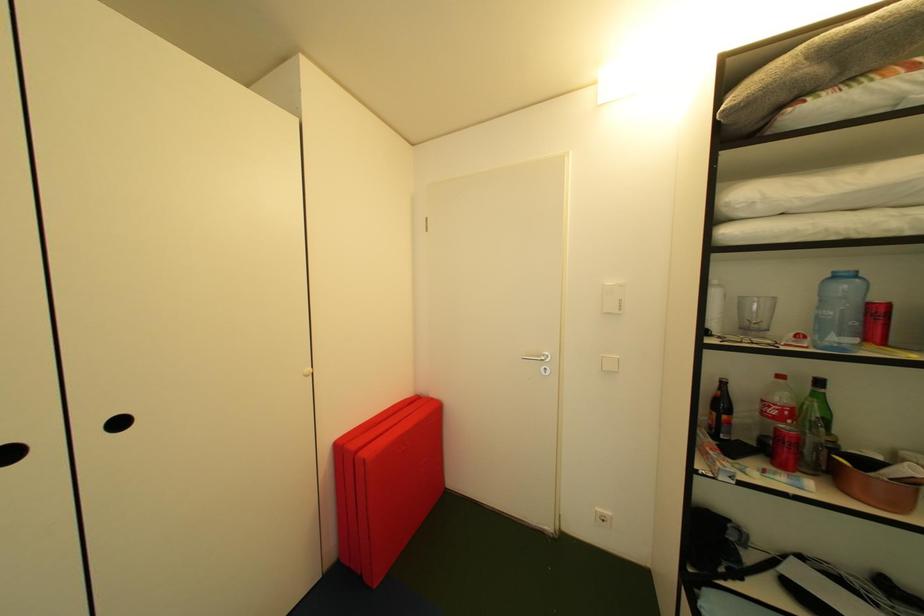
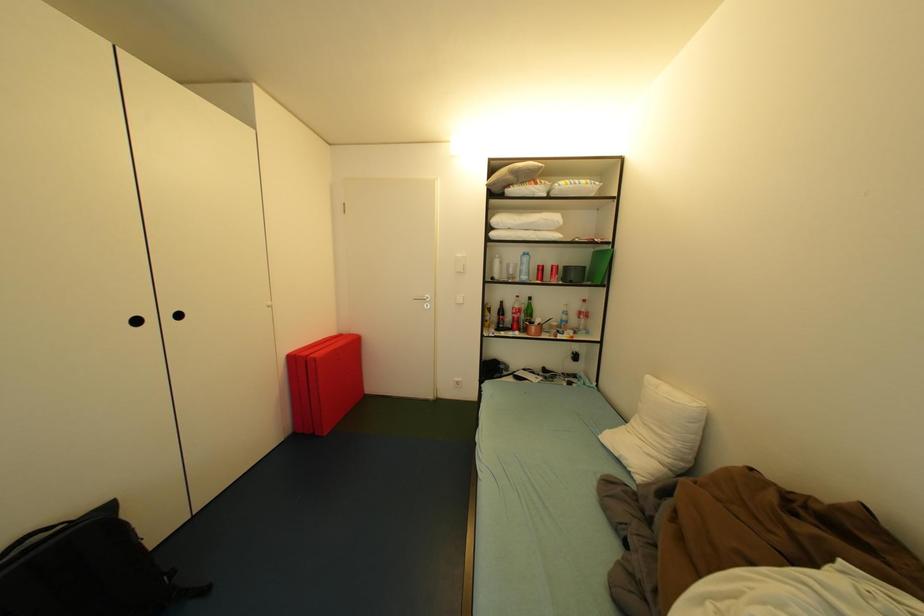
Question: Which direction would the cameraman need to move to produce the second image? Reply with the corresponding letter.

Choices:
 (A) Left
 (B) Right
 (C) Forward
 (D) Backward

Answer: (D)